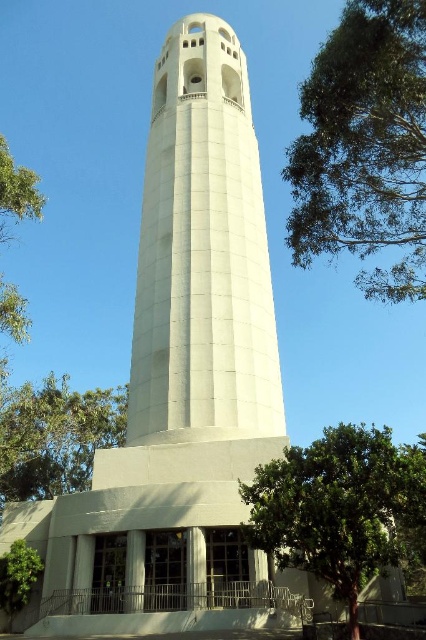
Question: Which of the following is the closest to the observer?

Choices:
 (A) (360, 243)
 (B) (249, 419)
 (C) (347, 604)
 (D) (65, 401)

Answer: (C)

Question: Which object is positioned closest to the green leafy tree at left?

Choices:
 (A) green leafy tree at lower right
 (B) green leafy tree at lower left
 (C) white concrete tower at center

Answer: (B)

Question: Is green leafy tree at lower right to the left of green leafy tree at lower left from the viewer's perspective?

Choices:
 (A) no
 (B) yes

Answer: (A)

Question: Where is green leafy tree at lower right located in relation to green leafy tree at lower left in the image?

Choices:
 (A) right
 (B) left

Answer: (A)

Question: Is green leafy tree at lower right to the left of green leafy tree at left from the viewer's perspective?

Choices:
 (A) yes
 (B) no

Answer: (B)

Question: Which point is closer to the camera?

Choices:
 (A) white concrete tower at center
 (B) green leafy tree at lower right

Answer: (B)